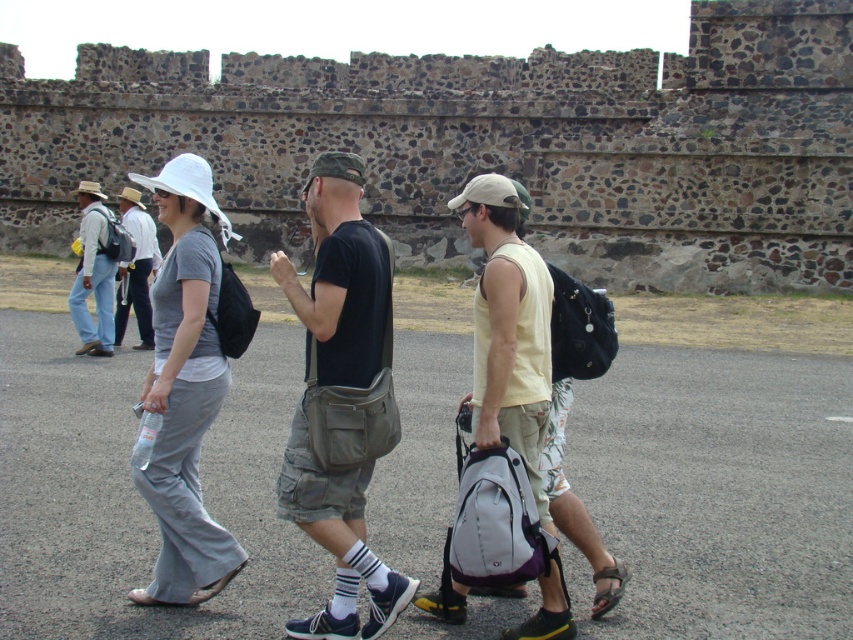
Can you confirm if white fabric hat at upper left is taller than camouflage fabric baseball cap at center?

Correct, white fabric hat at upper left is much taller as camouflage fabric baseball cap at center.

Is white fabric hat at upper left closer to camera compared to camouflage fabric baseball cap at center?

No, white fabric hat at upper left is behind camouflage fabric baseball cap at center.

Who is more distant from viewer, (143, 211) or (306, 179)?

Point (306, 179)

The width and height of the screenshot is (853, 640). I want to click on white fabric hat at upper left, so click(x=136, y=269).

How distant is white fabric hat at upper left from white matte baseball hat at center?

white fabric hat at upper left and white matte baseball hat at center are 44.78 feet apart from each other.

Locate an element on the screen. This screenshot has width=853, height=640. white fabric hat at upper left is located at coordinates (136, 269).

Find the location of a particular element. This screenshot has width=853, height=640. white fabric hat at upper left is located at coordinates (136, 269).

Can you confirm if dark gray cotton t-shirt at center is positioned to the left of light blue denim jeans at left?

Incorrect, dark gray cotton t-shirt at center is not on the left side of light blue denim jeans at left.

Consider the image. Is dark gray cotton t-shirt at center smaller than light blue denim jeans at left?

Actually, dark gray cotton t-shirt at center might be larger than light blue denim jeans at left.

Where is `dark gray cotton t-shirt at center`? dark gray cotton t-shirt at center is located at coordinates tap(341, 289).

What are the coordinates of `dark gray cotton t-shirt at center` in the screenshot? It's located at (341, 289).